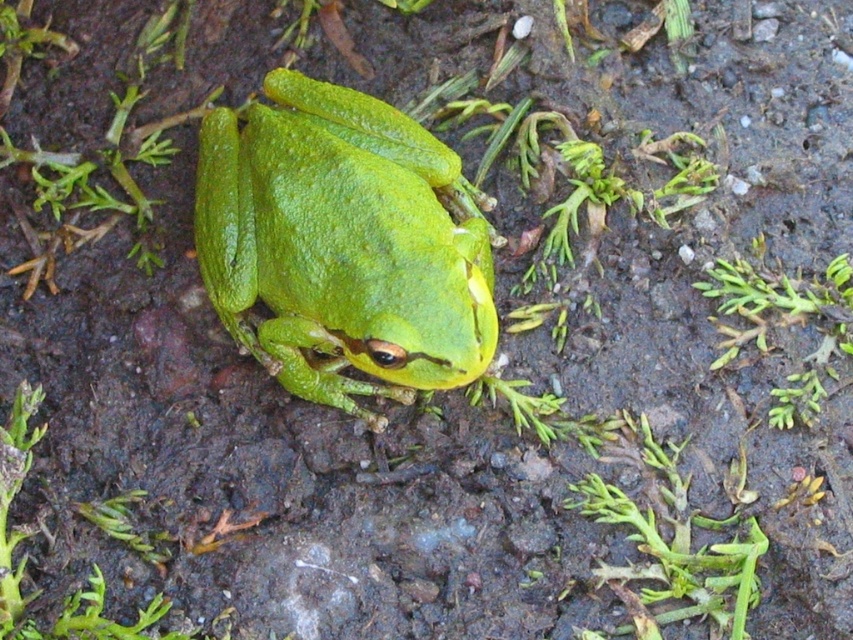
Question: Which of the following is the farthest from the observer?

Choices:
 (A) green leafy weed at lower left
 (B) green matte tree frog at center

Answer: (B)

Question: Which of the following is the closest to the observer?

Choices:
 (A) green leafy weed at lower left
 (B) green matte tree frog at center

Answer: (A)

Question: Is green matte tree frog at center to the right of green leafy weed at lower left from the viewer's perspective?

Choices:
 (A) no
 (B) yes

Answer: (B)

Question: Is green matte tree frog at center to the right of green leafy weed at lower left from the viewer's perspective?

Choices:
 (A) no
 (B) yes

Answer: (B)

Question: Which point is closer to the camera?

Choices:
 (A) green leafy weed at lower left
 (B) green matte tree frog at center

Answer: (A)

Question: Can you confirm if green matte tree frog at center is positioned above green leafy weed at lower left?

Choices:
 (A) no
 (B) yes

Answer: (B)